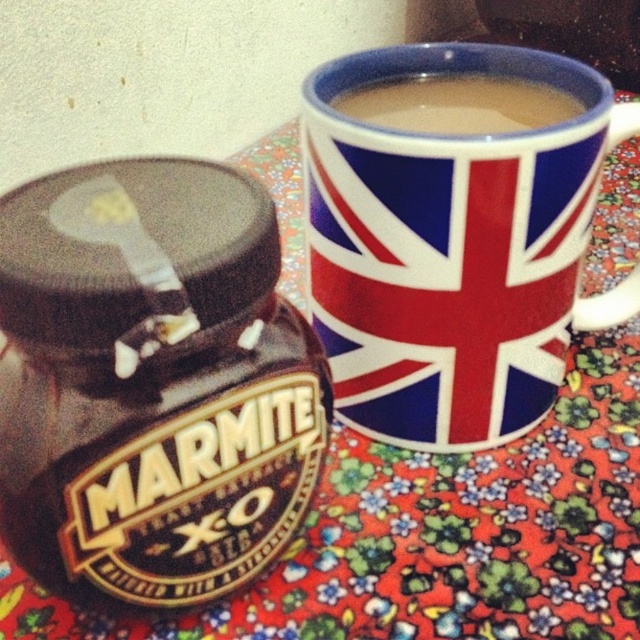
Question: Can you confirm if shiny brown marmite jar at left is positioned to the right of smooth ceramic mug at upper center?

Choices:
 (A) no
 (B) yes

Answer: (A)

Question: Which point is closer to the camera taking this photo?

Choices:
 (A) (381, 88)
 (B) (401, 250)

Answer: (B)

Question: Can you confirm if union jack ceramic mug at upper center is positioned to the right of smooth ceramic mug at upper center?

Choices:
 (A) no
 (B) yes

Answer: (B)

Question: Which object is closer to the camera taking this photo?

Choices:
 (A) shiny brown marmite jar at left
 (B) smooth ceramic mug at upper center

Answer: (A)

Question: Which of the following is the closest to the observer?

Choices:
 (A) (433, 257)
 (B) (134, 413)
 (C) (400, 99)

Answer: (B)

Question: Does shiny brown marmite jar at left come behind smooth ceramic mug at upper center?

Choices:
 (A) yes
 (B) no

Answer: (B)